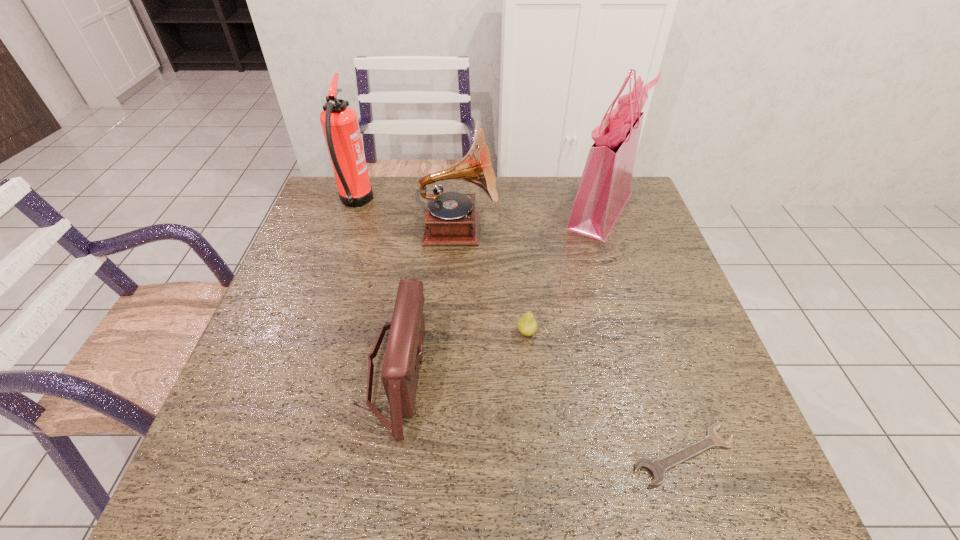
The width and height of the screenshot is (960, 540). I want to click on object situated at the far left corner, so click(x=339, y=122).

This screenshot has width=960, height=540. What are the coordinates of `object located at the far right corner` in the screenshot? It's located at (605, 186).

The width and height of the screenshot is (960, 540). Identify the location of object that is at the near right corner. (657, 467).

Locate an element on the screen. vacant space at the far edge of the desktop is located at coordinates (477, 192).

In the image, there is a desktop. Where is `vacant region at the near edge`? The height and width of the screenshot is (540, 960). vacant region at the near edge is located at coordinates (564, 475).

Locate an element on the screen. The image size is (960, 540). free space at the left edge of the desktop is located at coordinates (299, 388).

Locate an element on the screen. This screenshot has width=960, height=540. vacant space at the right edge of the desktop is located at coordinates (620, 285).

Where is `vacant area at the near right corner of the desktop`? The height and width of the screenshot is (540, 960). vacant area at the near right corner of the desktop is located at coordinates (708, 465).

The width and height of the screenshot is (960, 540). I want to click on empty space that is in between the second shortest object and the shopping bag, so click(x=564, y=271).

Locate an element on the screen. The image size is (960, 540). vacant area that lies between the shoulder bag and the fourth object from left to right is located at coordinates (463, 351).